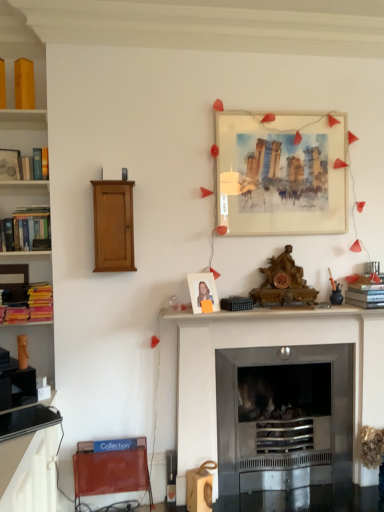
Question: Can you confirm if hardcover book at left, the second book positioned from the right, is shorter than hardcover book at right, which is the 1th book from right to left?

Choices:
 (A) no
 (B) yes

Answer: (B)

Question: Is hardcover book at left, the second book positioned from the right, located outside hardcover book at right, which is the 1th book from bottom to top?

Choices:
 (A) yes
 (B) no

Answer: (A)

Question: Is hardcover book at left, the second book positioned from the right, directly adjacent to hardcover book at right, placed as the 2th book when sorted from top to bottom?

Choices:
 (A) no
 (B) yes

Answer: (A)

Question: From the image's perspective, is hardcover book at left, arranged as the 1th book when viewed from the left, under hardcover book at right, placed as the 2th book when sorted from top to bottom?

Choices:
 (A) yes
 (B) no

Answer: (B)

Question: Is hardcover book at left, the second book positioned from the right, to the right of hardcover book at right, the second book positioned from the left, from the viewer's perspective?

Choices:
 (A) no
 (B) yes

Answer: (A)

Question: From a real-world perspective, is hardcover book at left, the second book positioned from the right, located higher than hardcover book at right, which is the 1th book from bottom to top?

Choices:
 (A) yes
 (B) no

Answer: (A)

Question: Is hardcover book at right, which is the 1th book from right to left, to the right of matte white photo frame at center, the 1th picture frame ordered from the bottom, from the viewer's perspective?

Choices:
 (A) no
 (B) yes

Answer: (B)

Question: From the image's perspective, is hardcover book at right, which is the 1th book from right to left, located above matte white photo frame at center, arranged as the second picture frame when viewed from the back?

Choices:
 (A) no
 (B) yes

Answer: (B)

Question: Does hardcover book at right, the second book positioned from the left, turn towards matte white photo frame at center, the 1th picture frame ordered from the bottom?

Choices:
 (A) yes
 (B) no

Answer: (B)

Question: From a real-world perspective, is hardcover book at right, placed as the 2th book when sorted from top to bottom, below matte white photo frame at center, the 1th picture frame viewed from the front?

Choices:
 (A) yes
 (B) no

Answer: (A)

Question: Is hardcover book at right, placed as the 2th book when sorted from top to bottom, closer to camera compared to matte white photo frame at center, which is the 1th picture frame from left to right?

Choices:
 (A) no
 (B) yes

Answer: (A)

Question: Considering the relative sizes of hardcover book at right, the second book positioned from the left, and matte white photo frame at center, arranged as the second picture frame when viewed from the back, in the image provided, is hardcover book at right, the second book positioned from the left, thinner than matte white photo frame at center, arranged as the second picture frame when viewed from the back,?

Choices:
 (A) yes
 (B) no

Answer: (B)

Question: Is hardcover books at left far from metallic silver fireplace at center?

Choices:
 (A) no
 (B) yes

Answer: (B)